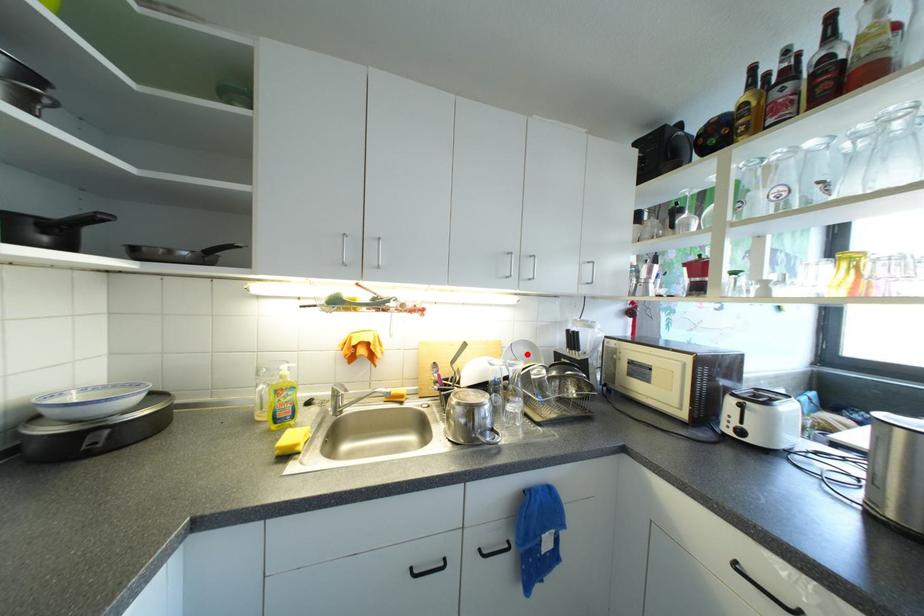
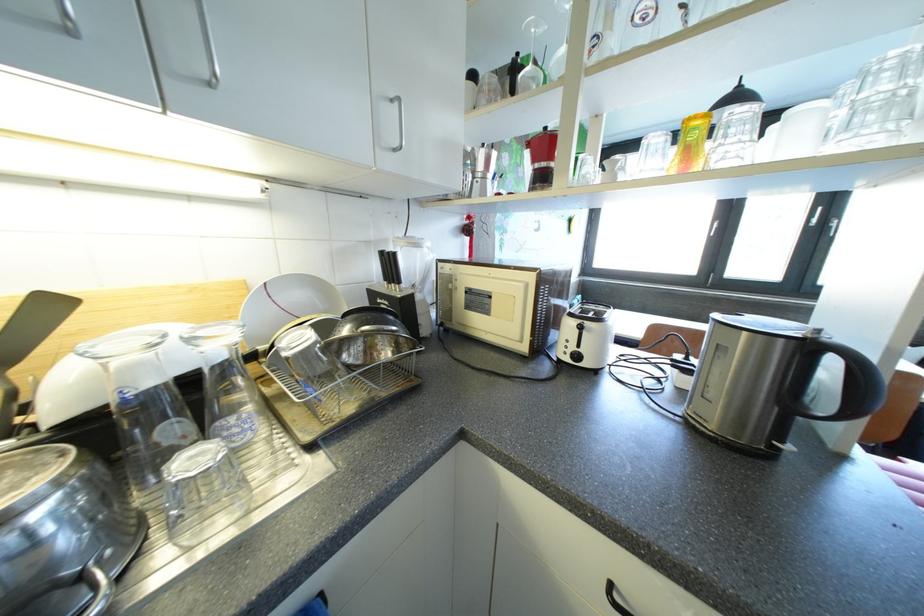
Locate, in the second image, the point that corresponds to the highlighted location in the first image.

(300, 299)